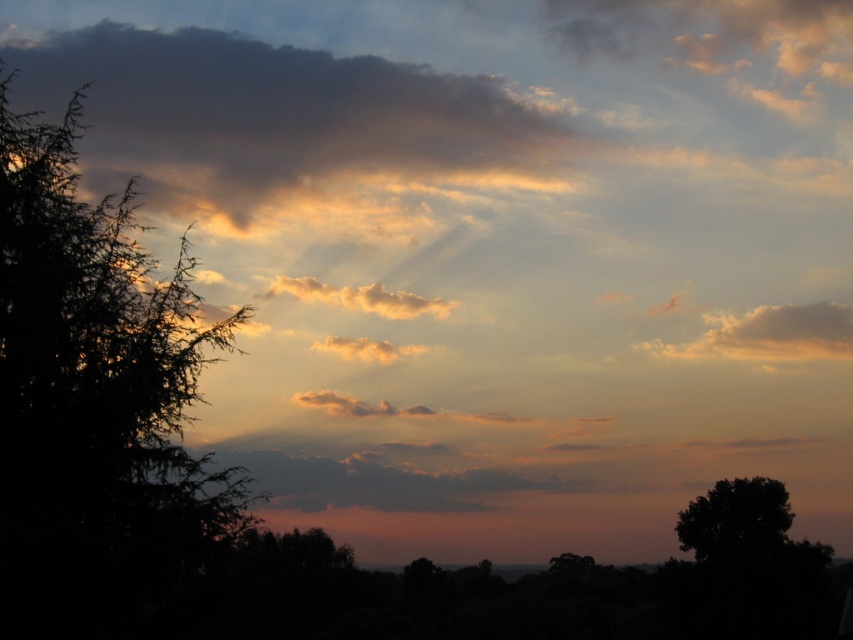
Is point (437, 298) closer to camera compared to point (567, 557)?

No.

Describe the element at coordinates (361, 298) in the screenshot. Image resolution: width=853 pixels, height=640 pixels. I see `golden fluffy cloud at center` at that location.

Where is `golden fluffy cloud at center`? golden fluffy cloud at center is located at coordinates (361, 298).

Which is in front, point (756, 500) or point (287, 289)?

Point (756, 500) is in front.

Between black matte tree at lower right and golden fluffy cloud at center, which one appears on the right side from the viewer's perspective?

black matte tree at lower right is more to the right.

Does point (715, 524) lie behind point (358, 298)?

No, it is not.

Locate an element on the screen. The width and height of the screenshot is (853, 640). black matte tree at lower right is located at coordinates (735, 522).

Which of these two, dark green leafy tree at left or green matte tree at lower right, stands taller?

dark green leafy tree at left is taller.

Between dark green leafy tree at left and green matte tree at lower right, which one has less height?

With less height is green matte tree at lower right.

Locate an element on the screen. This screenshot has width=853, height=640. dark green leafy tree at left is located at coordinates (94, 396).